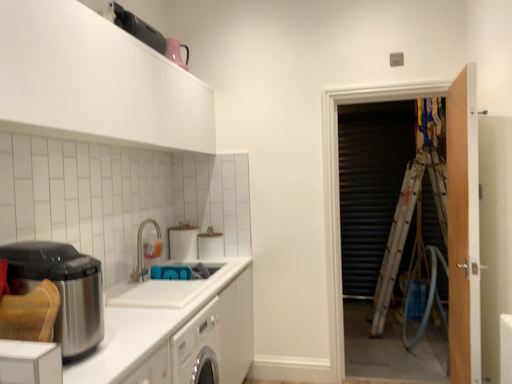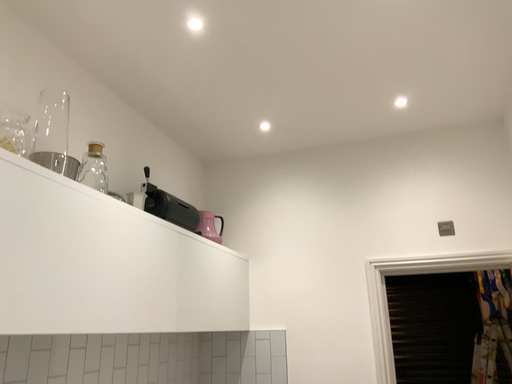
Question: Which way did the camera rotate in the video?

Choices:
 (A) rotated upward
 (B) rotated downward

Answer: (A)